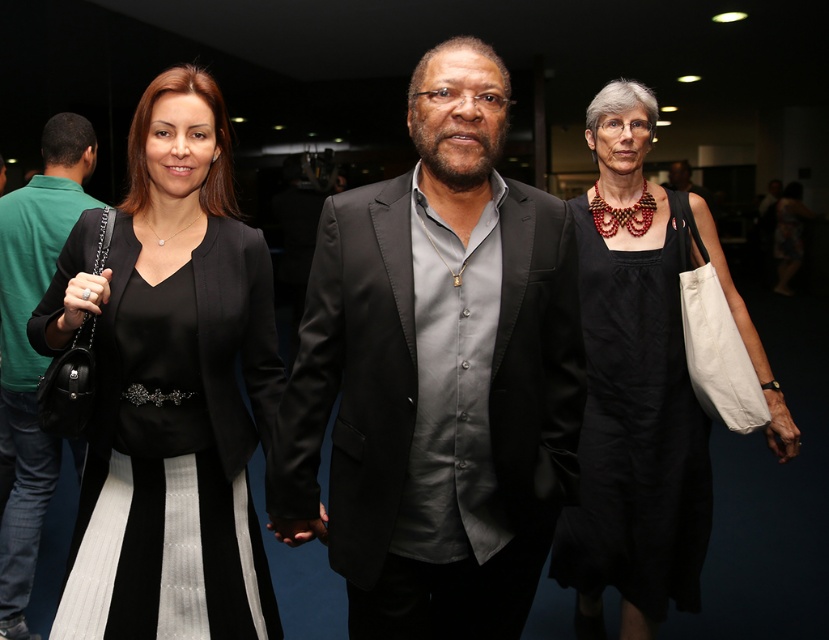
In the scene shown: Which object is located at the coordinates point (437, 376)?

The point (437, 376) is located on the satin black suit at center.

Based on the scene description, where is the satin black suit at center located in the image?

The satin black suit at center is located at point (x=437, y=376) in the image.